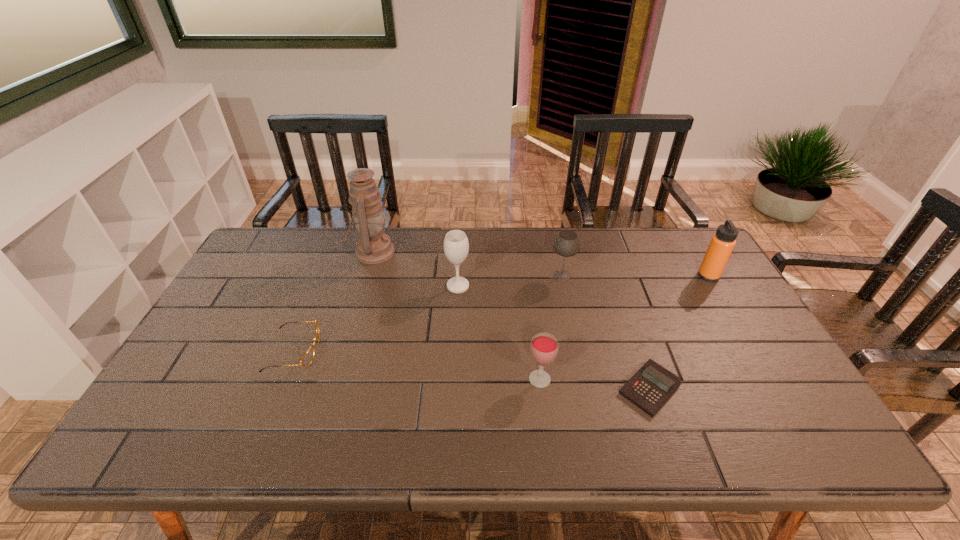
You are a GUI agent. You are given a task and a screenshot of the screen. Output one action in this format:
    pyautogui.click(x=<x>, y=<y>)
    Task: Click on the vacant area situated 0.240m on the left of the oil lamp
    This screenshot has height=540, width=960.
    Given the screenshot: What is the action you would take?
    pos(281,252)

Locate an element on the screen. vacant position located 0.060m on the back of the thermos bottle is located at coordinates (698, 258).

Image resolution: width=960 pixels, height=540 pixels. Find the location of `free spot located 0.120m on the back of the tallest wineglass`. free spot located 0.120m on the back of the tallest wineglass is located at coordinates (460, 255).

Locate an element on the screen. free spot located 0.210m on the front of the fifth object from left to right is located at coordinates (574, 335).

This screenshot has height=540, width=960. I want to click on vacant space located on the right of the nearest wineglass, so click(684, 379).

Where is `free space located 0.390m on the front-facing side of the second shortest object`? The image size is (960, 540). free space located 0.390m on the front-facing side of the second shortest object is located at coordinates (464, 350).

This screenshot has height=540, width=960. I want to click on vacant space situated on the left of the shortest object, so click(511, 388).

This screenshot has width=960, height=540. What are the coordinates of `oil lamp at the far edge` in the screenshot? It's located at (373, 246).

Where is `thermos bottle that is at the far edge`? Image resolution: width=960 pixels, height=540 pixels. thermos bottle that is at the far edge is located at coordinates click(x=722, y=243).

Identify the location of wineglass at the far edge. The width and height of the screenshot is (960, 540). (566, 244).